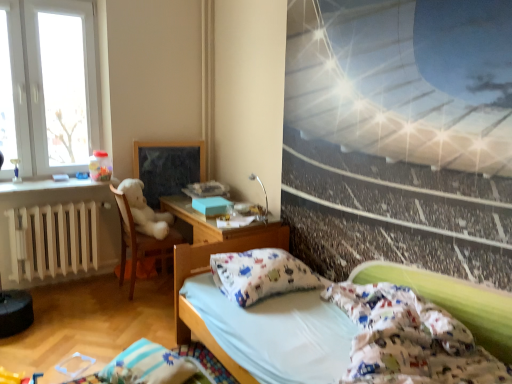
Question: Is matte black picture frame at center to the left of white cotton bed at lower right from the viewer's perspective?

Choices:
 (A) no
 (B) yes

Answer: (B)

Question: Is matte black picture frame at center facing away from white cotton bed at lower right?

Choices:
 (A) no
 (B) yes

Answer: (A)

Question: Is matte black picture frame at center positioned before white cotton bed at lower right?

Choices:
 (A) yes
 (B) no

Answer: (B)

Question: Is the surface of matte black picture frame at center in direct contact with white cotton bed at lower right?

Choices:
 (A) no
 (B) yes

Answer: (A)

Question: Is matte black picture frame at center positioned behind white cotton bed at lower right?

Choices:
 (A) yes
 (B) no

Answer: (A)

Question: Would you say white plush at left is inside or outside white matte radiator at left?

Choices:
 (A) outside
 (B) inside

Answer: (A)

Question: In terms of height, does white plush at left look taller or shorter compared to white matte radiator at left?

Choices:
 (A) short
 (B) tall

Answer: (B)

Question: Is white plush at left bigger or smaller than white matte radiator at left?

Choices:
 (A) big
 (B) small

Answer: (A)

Question: Considering the positions of point [135, 246] and point [38, 244], is point [135, 246] closer or farther from the camera than point [38, 244]?

Choices:
 (A) closer
 (B) farther

Answer: (B)

Question: From a real-world perspective, relative to white cotton pillow at center, the 1th pillow in the right-to-left sequence, is white matte radiator at left vertically above or below?

Choices:
 (A) above
 (B) below

Answer: (B)

Question: Looking at their shapes, would you say white matte radiator at left is wider or thinner than white cotton pillow at center, marked as the second pillow in a bottom-to-top arrangement?

Choices:
 (A) thin
 (B) wide

Answer: (A)

Question: From the image's perspective, relative to white cotton pillow at center, which is the 1th pillow from top to bottom, is white matte radiator at left above or below?

Choices:
 (A) below
 (B) above

Answer: (B)

Question: Considering the positions of white matte radiator at left and white cotton pillow at center, marked as the second pillow in a left-to-right arrangement, in the image, is white matte radiator at left taller or shorter than white cotton pillow at center, marked as the second pillow in a left-to-right arrangement,?

Choices:
 (A) short
 (B) tall

Answer: (B)

Question: From a real-world perspective, is blue striped pillow at lower left, arranged as the 1th pillow when viewed from the left, positioned above or below white matte radiator at left?

Choices:
 (A) below
 (B) above

Answer: (A)

Question: Is blue striped pillow at lower left, placed as the second pillow when sorted from top to bottom, spatially inside white matte radiator at left, or outside of it?

Choices:
 (A) outside
 (B) inside

Answer: (A)